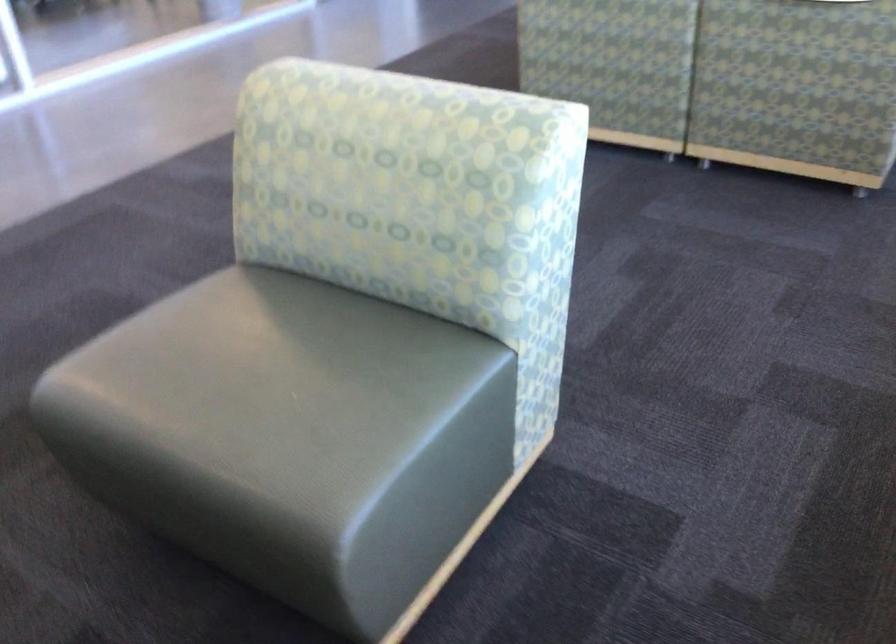
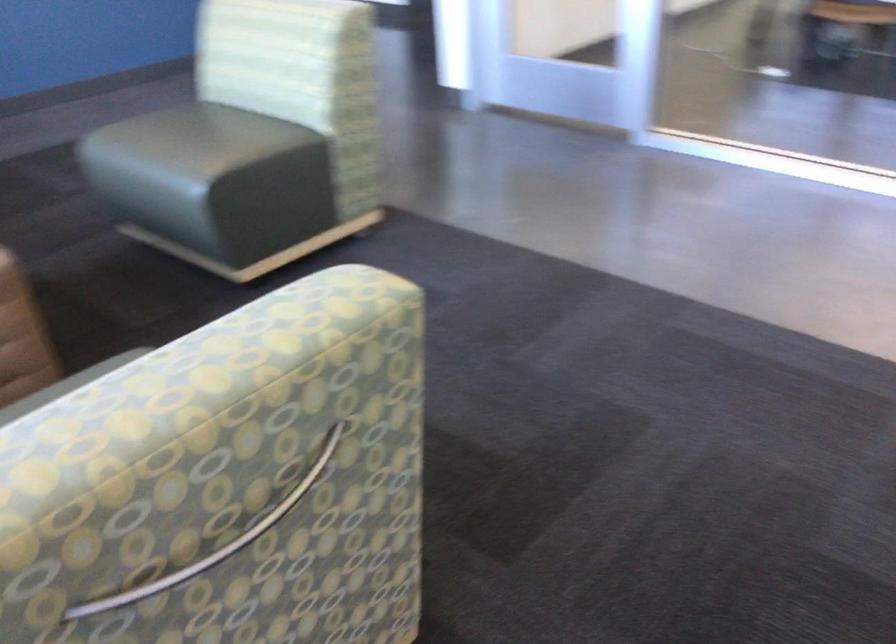
Locate, in the second image, the point that corresponds to the point at 449,156 in the first image.

(216, 542)